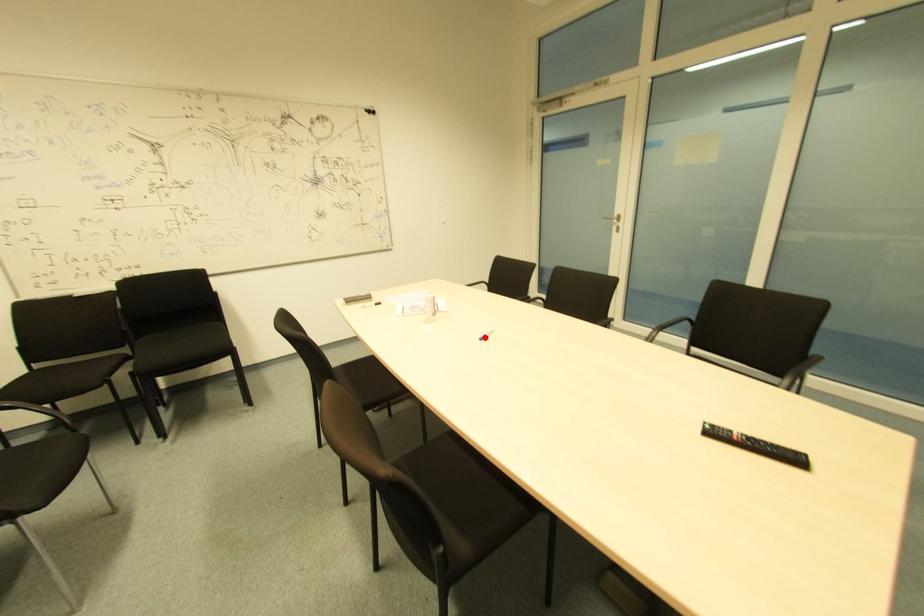
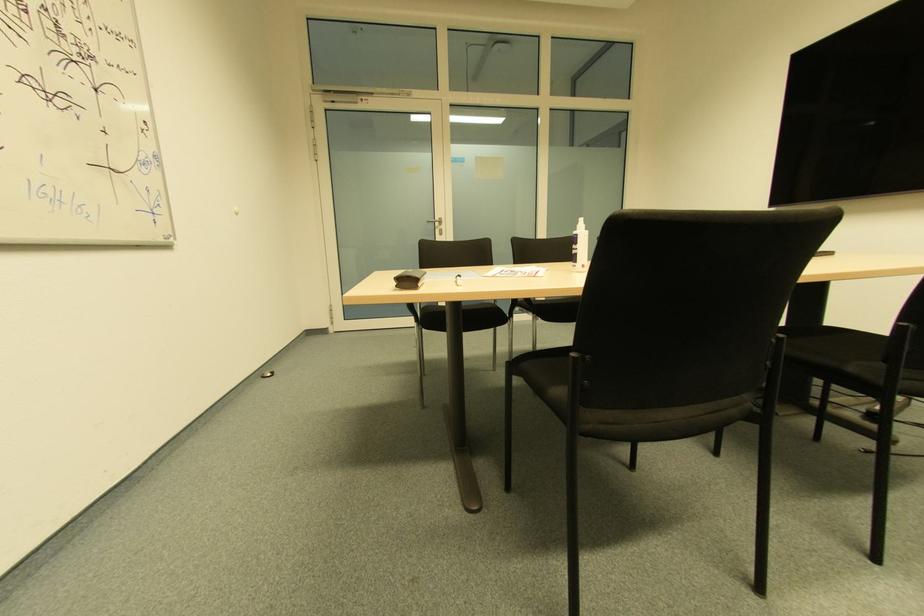
Question: I am providing you with two images of the same scene from different viewpoints. A red point is marked on the first image. At the location where the point appears in image 1, is it still visible in image 2?

Choices:
 (A) Yes
 (B) No

Answer: (B)